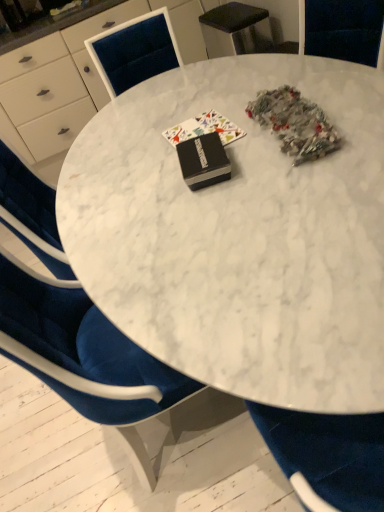
Locate an element on the screen. This screenshot has width=384, height=512. free spot in front of black matte book at center, which appears as the first book when viewed from the back is located at coordinates (227, 156).